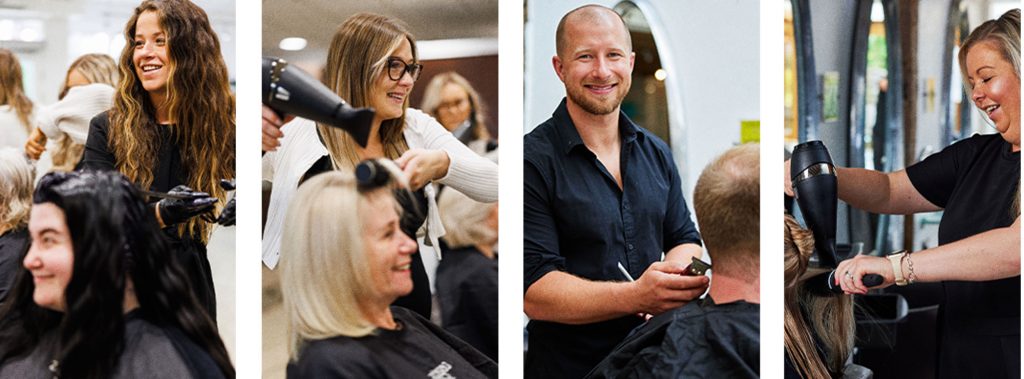
At what (x,y) coordinates should I click in order to perform the action: click on hairbrushes. Please return your answer as a coordinate pair (x, y). This screenshot has height=379, width=1024. Looking at the image, I should click on (817, 286), (371, 169).